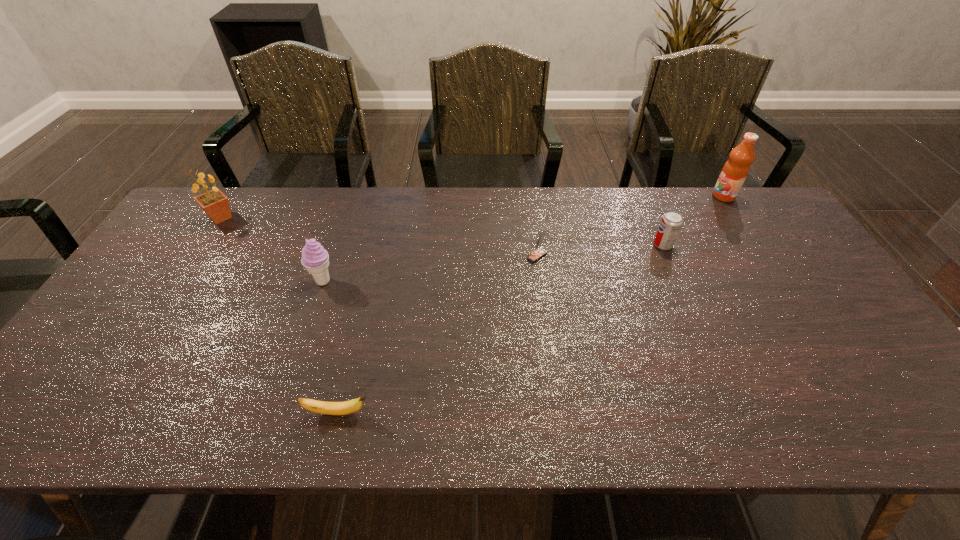
The height and width of the screenshot is (540, 960). I want to click on blank space located 0.120m on the front label of the fruit juice, so click(x=678, y=196).

The height and width of the screenshot is (540, 960). I want to click on vacant space situated on the front label of the fruit juice, so click(x=645, y=196).

Locate an element on the screen. free space located 0.340m on the front label of the fruit juice is located at coordinates (613, 196).

Identify the location of free region located 0.120m at the front of the leftmost object with flowers visible. Image resolution: width=960 pixels, height=540 pixels. (275, 218).

Where is `vacant space located 0.260m on the left of the icecream`? vacant space located 0.260m on the left of the icecream is located at coordinates (218, 281).

I want to click on vacant space located 0.060m on the right of the matchbox, so click(567, 256).

Where is `vacant area located 0.250m on the left of the second object from right to left`? The width and height of the screenshot is (960, 540). vacant area located 0.250m on the left of the second object from right to left is located at coordinates coord(571,245).

This screenshot has height=540, width=960. What are the coordinates of `free point located 0.080m at the stem of the shortest object` in the screenshot? It's located at (407, 413).

Where is `fruit juice at the far edge`? Image resolution: width=960 pixels, height=540 pixels. fruit juice at the far edge is located at coordinates (736, 169).

Locate an element on the screen. sunflower positioned at the far edge is located at coordinates (215, 204).